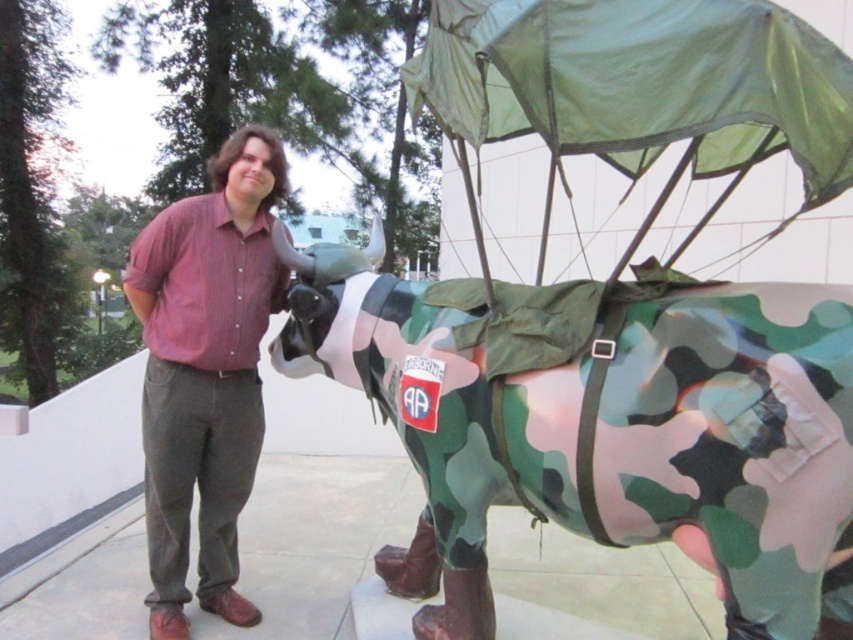
You are a photographer trying to capture a photo of the camouflage fabric cow at right and the matte red shirt at center. Based on their heights, which object should you focus on first if you want to ensure both are in frame without adjusting the camera angle?

The camouflage fabric cow at right is not as tall as the matte red shirt at center, so you should focus on the matte red shirt at center first to ensure both are in frame.